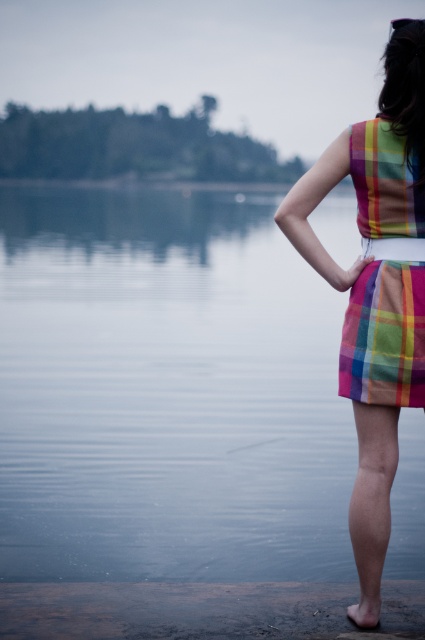
Between point (51, 531) and point (391, 349), which one is positioned behind?

The point (51, 531) is more distant.

Can you confirm if transparent water at center is taller than plaid fabric dress at center?

Yes.

Does point (40, 529) come in front of point (346, 346)?

No, it is not.

Locate an element on the screen. The image size is (425, 640). transparent water at center is located at coordinates (167, 392).

Can you confirm if plaid fabric dress at right is wider than plaid fabric dress at center?

Yes, plaid fabric dress at right is wider than plaid fabric dress at center.

Image resolution: width=425 pixels, height=640 pixels. What are the coordinates of `plaid fabric dress at right` in the screenshot? It's located at (373, 291).

Where is `plaid fabric dress at right`? The width and height of the screenshot is (425, 640). plaid fabric dress at right is located at coordinates click(x=373, y=291).

Is point (112, 380) positioned after point (280, 227)?

That is True.

The height and width of the screenshot is (640, 425). Describe the element at coordinates (167, 392) in the screenshot. I see `transparent water at center` at that location.

Find the location of a particular element. transparent water at center is located at coordinates (167, 392).